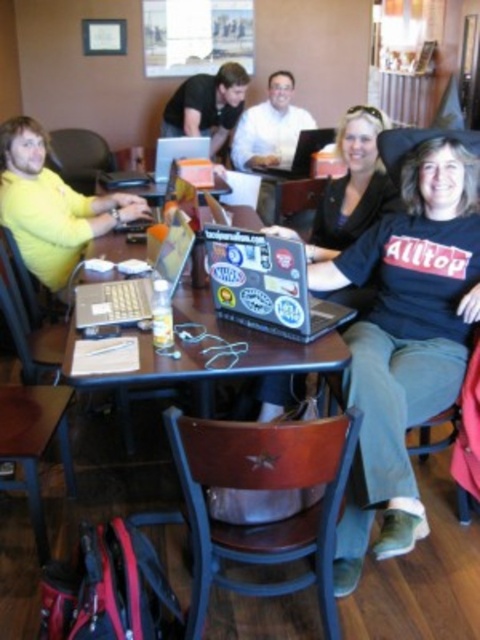
Based on the photo, you are standing at the entrance of the room and want to walk towards the two points labeled as point (229, 129) and point (299, 145). Which point will you reach first?

You will reach point (229, 129) first because it is closer to you than point (299, 145), which is further away.